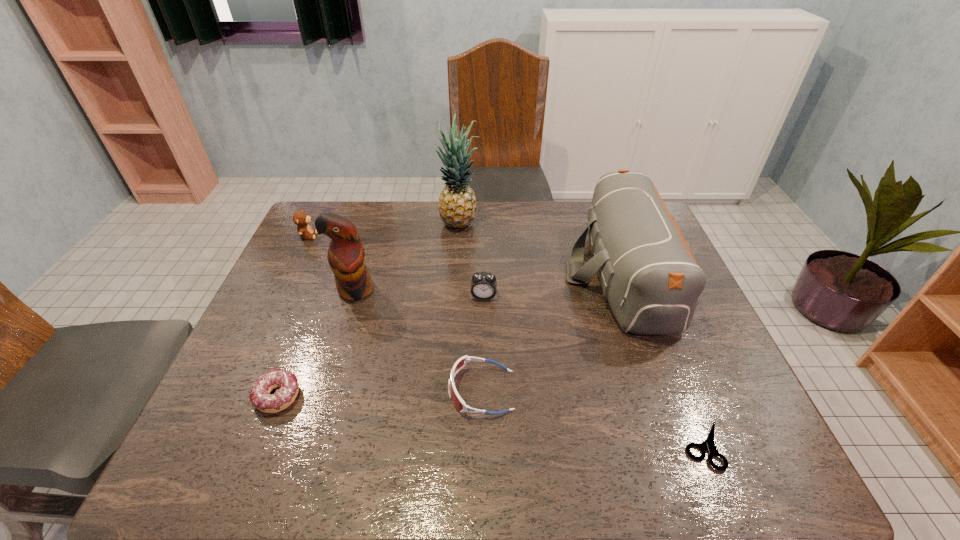
In order to click on duffel bag that is at the far edge in this screenshot , I will do `click(647, 272)`.

At what (x,y) coordinates should I click in order to perform the action: click on teddy bear positioned at the far edge. Please return your answer as a coordinate pair (x, y). Image resolution: width=960 pixels, height=540 pixels. Looking at the image, I should click on (300, 218).

The image size is (960, 540). I want to click on object at the near edge, so click(709, 444).

You are a GUI agent. You are given a task and a screenshot of the screen. Output one action in this format:
    pyautogui.click(x=<x>, y=<y>)
    Task: Click on the teddy bear present at the left edge
    
    Given the screenshot: What is the action you would take?
    pyautogui.click(x=300, y=218)

Locate an element on the screen. The width and height of the screenshot is (960, 540). doughnut that is positioned at the left edge is located at coordinates (260, 398).

Identify the location of duffel bag located at the right edge. (647, 272).

The height and width of the screenshot is (540, 960). What are the coordinates of `shears that is at the right edge` in the screenshot? It's located at (709, 444).

Locate an element on the screen. object located in the far left corner section of the desktop is located at coordinates (300, 218).

The image size is (960, 540). In order to click on object that is at the far right corner in this screenshot , I will do `click(647, 272)`.

The width and height of the screenshot is (960, 540). Identify the location of object present at the near right corner. (709, 444).